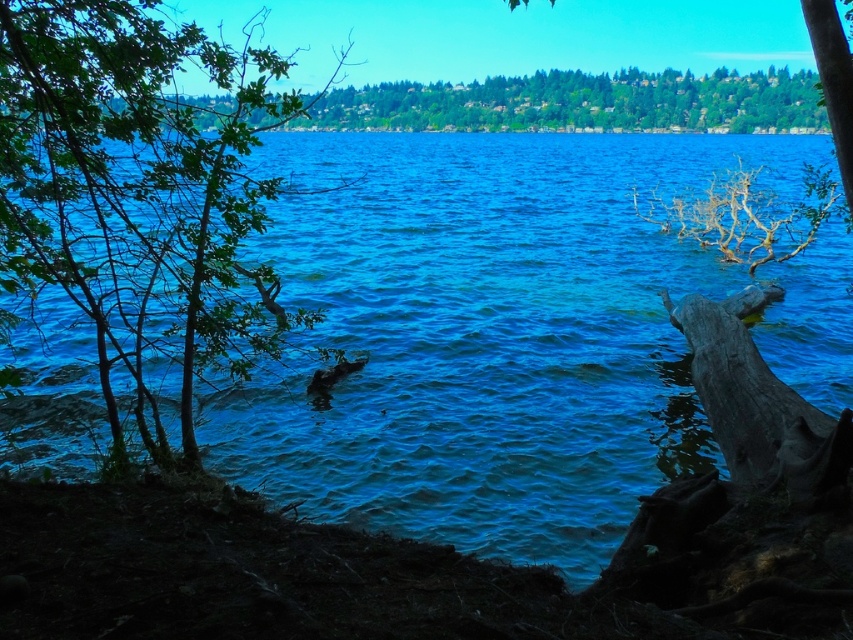
Is point (636, 177) positioned in front of point (169, 168)?

No.

Between blue water at center and green leafy tree at left, which one appears on the right side from the viewer's perspective?

blue water at center is more to the right.

Does point (381, 164) come behind point (61, 180)?

Yes, point (381, 164) is farther from viewer.

Find the location of a particular element. The image size is (853, 640). blue water at center is located at coordinates (508, 332).

The height and width of the screenshot is (640, 853). What do you see at coordinates (508, 332) in the screenshot?
I see `blue water at center` at bounding box center [508, 332].

Is blue water at center to the left of green leafy tree at upper center from the viewer's perspective?

Indeed, blue water at center is positioned on the left side of green leafy tree at upper center.

Does point (682, 266) come behind point (340, 104)?

No, it is in front of (340, 104).

This screenshot has height=640, width=853. What are the coordinates of `blue water at center` in the screenshot? It's located at (508, 332).

Is green leafy tree at left bigger than green leafy tree at upper center?

Indeed, green leafy tree at left has a larger size compared to green leafy tree at upper center.

Does point (85, 205) come behind point (601, 108)?

That is False.

This screenshot has height=640, width=853. I want to click on green leafy tree at left, so click(138, 193).